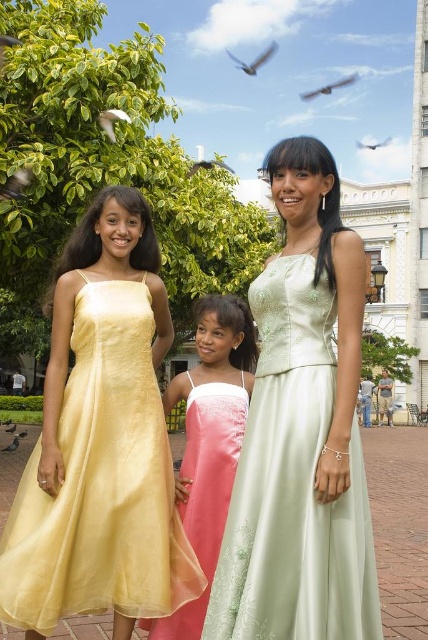
In the scene described, there are two dresses mentioned. The matte yellow dress at center and the satin pale green dress at center. From the perspective of someone facing the image, which dress is positioned to the left?

The matte yellow dress at center is positioned to the left of the satin pale green dress at center.

You are a photographer trying to capture a photo of the three people in the scene. You notice two birds in the sky that might interfere with your shot. The smooth feathered bird at upper center and the brown feathered bird at center. Which bird is wider and might block more of the background when they fly in front of the people?

The smooth feathered bird at upper center is wider than the brown feathered bird at center, so it might block more of the background when flying in front of the people.

Looking at this image, you are a photographer standing in the public square. You want to take a photo that includes all three people and the smooth feathered bird at upper center. Given their distances, is it possible to frame them all in one shot without moving any of them?

The three people and the smooth feathered bird at upper center are 113.80 meters apart. This distance is too large to capture all elements in a single frame without moving them, so it is not possible.